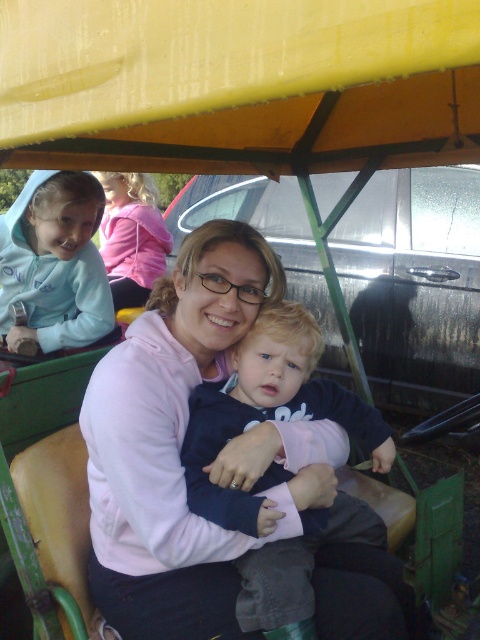
Is light blue fleece jacket at upper left positioned in front of pink fleece jacket at upper left?

Yes, it is.

Does light blue fleece jacket at upper left appear on the left side of pink fleece jacket at upper left?

In fact, light blue fleece jacket at upper left is to the right of pink fleece jacket at upper left.

Does point (34, 234) come farther from viewer compared to point (107, 186)?

No, (34, 234) is closer to viewer.

Where is `light blue fleece jacket at upper left`? light blue fleece jacket at upper left is located at coordinates (55, 262).

Can you confirm if dark blue fleece at center is taller than pink fleece jacket at upper left?

In fact, dark blue fleece at center may be shorter than pink fleece jacket at upper left.

Which of these two, dark blue fleece at center or pink fleece jacket at upper left, stands shorter?

dark blue fleece at center is shorter.

Is point (356, 508) behind point (115, 305)?

No, (356, 508) is in front of (115, 305).

Identify the location of dark blue fleece at center. The image size is (480, 640). (269, 410).

Who is more distant from viewer, (x=288, y=362) or (x=55, y=314)?

Positioned behind is point (x=55, y=314).

Based on the photo, who is higher up, dark blue fleece at center or light blue fleece jacket at upper left?

light blue fleece jacket at upper left

I want to click on dark blue fleece at center, so click(x=269, y=410).

Where is `dark blue fleece at center`? The width and height of the screenshot is (480, 640). dark blue fleece at center is located at coordinates (269, 410).